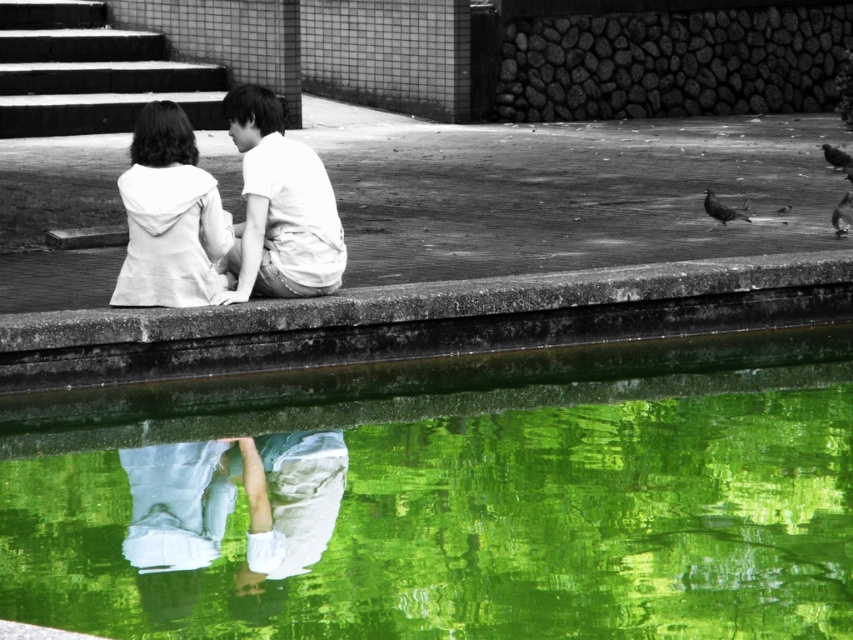
Which is above, white matte hoodie at upper left or dark gray feathered bird at upper right?

dark gray feathered bird at upper right is above.

Can you confirm if white matte hoodie at upper left is wider than dark gray feathered bird at upper right?

Correct, the width of white matte hoodie at upper left exceeds that of dark gray feathered bird at upper right.

Is point (155, 112) behind point (836, 150)?

No, it is in front of (836, 150).

The image size is (853, 640). I want to click on white matte hoodie at upper left, so click(x=169, y=216).

Which is more to the right, smooth black bird at upper right or dark gray feathered bird at upper right?

dark gray feathered bird at upper right

Is smooth black bird at upper right positioned before dark gray feathered bird at upper right?

Yes, smooth black bird at upper right is closer to the viewer.

Measure the distance between point [836,218] and camera.

12.68 meters

Locate an element on the screen. This screenshot has height=640, width=853. smooth black bird at upper right is located at coordinates (842, 214).

Does concrete ledge at center have a greater height compared to white matte hoodie at upper left?

Incorrect, concrete ledge at center's height is not larger of white matte hoodie at upper left's.

This screenshot has width=853, height=640. Describe the element at coordinates (424, 321) in the screenshot. I see `concrete ledge at center` at that location.

Between point (415, 353) and point (173, 118), which one is positioned behind?

The point (415, 353) is more distant.

Where is `concrete ledge at center`? concrete ledge at center is located at coordinates (424, 321).